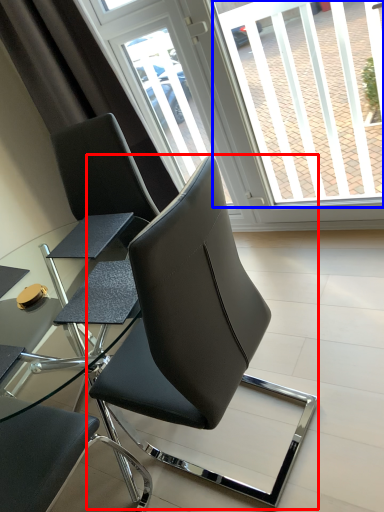
Question: Which point is further to the camera, chair (highlighted by a red box) or window screen (highlighted by a blue box)?

Choices:
 (A) chair
 (B) window screen

Answer: (B)